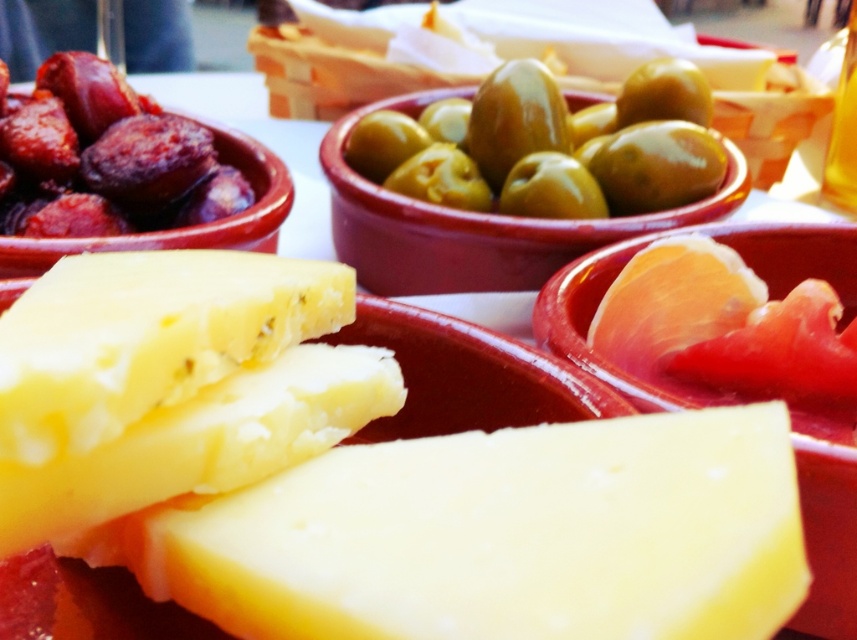
You are arranging a tapas platter and need to place the yellow creamy cheese at center and the green glossy olives at center in a specific order. According to the image, which one should be placed lower on the platter?

The yellow creamy cheese at center should be placed lower on the platter because it is positioned below the green glossy olives at center in the image.

You are a chef preparing a tapas platter and need to arrange the yellow creamy cheese at center and the green glossy olives at center. Which food item should you place first if you want to ensure there is enough space for both on the plate?

The yellow creamy cheese at center has a lesser width compared to the green glossy olives at center. Therefore, you should place the green glossy olives at center first to accommodate their larger size, ensuring there is sufficient space for both items on the plate.

You are a food critic evaluating the arrangement of this tapas table. You notice a specific point on the table at coordinates (548,147). What food item is located exactly at that point?

The point at coordinates (548,147) has green glossy olives at center placed there.